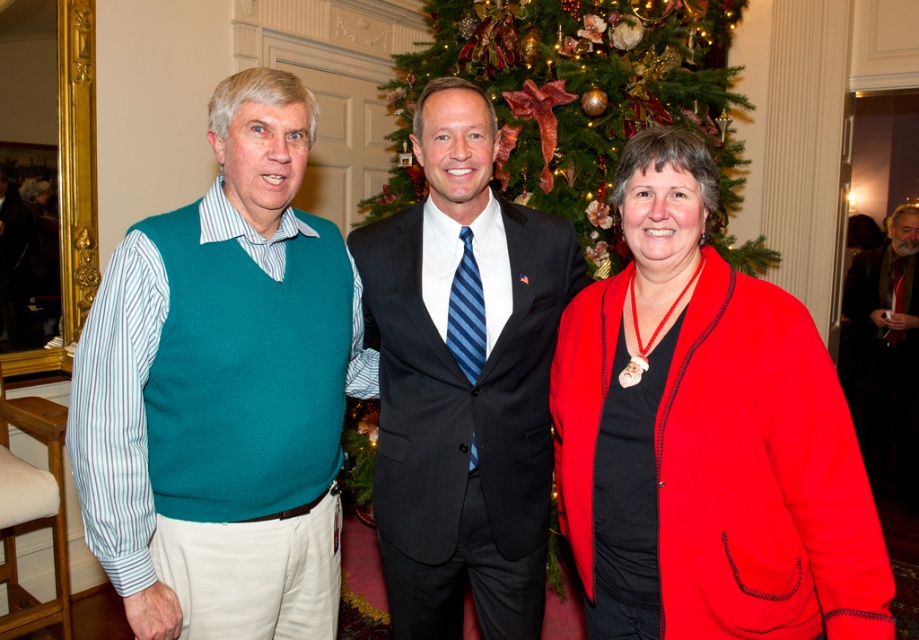
You are a photographer adjusting the camera to focus on the teal sweater vest at center and the dark gray suit at center. Which one is positioned higher in the frame?

The teal sweater vest at center is located above the dark gray suit at center, so it is positioned higher in the frame.

You are standing at the origin point in the image. Which of the two points, point (233,464) or point (722,12), is closer to you?

Point (233,464) is closer to you because it is in front of point (722,12).